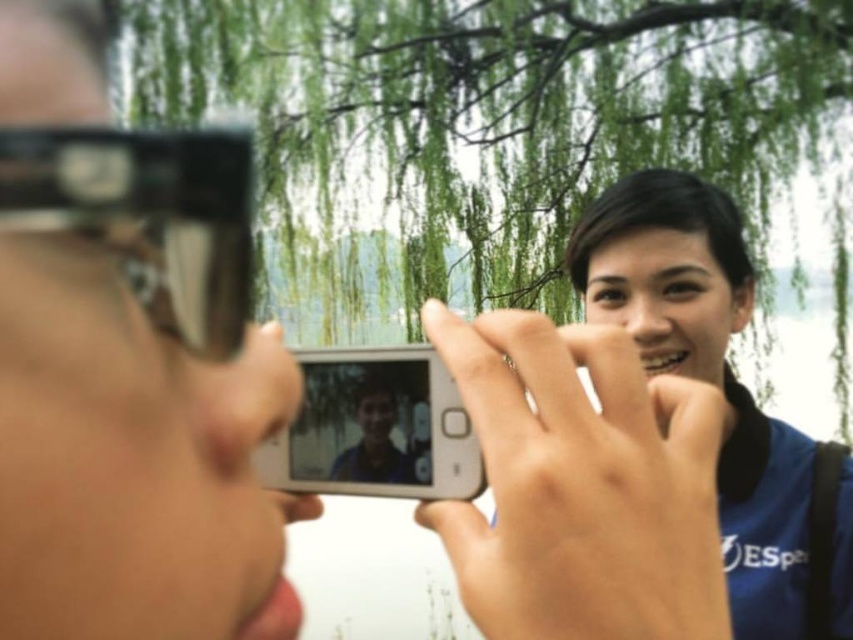
Question: Among these objects, which one is nearest to the camera?

Choices:
 (A) blue fabric shirt at center
 (B) white glossy smartphone at center
 (C) matte black goggles at upper left
 (D) green leafy tree at upper center

Answer: (B)

Question: Which of the following is the farthest from the observer?

Choices:
 (A) green leafy tree at upper center
 (B) white glossy smartphone at center

Answer: (A)

Question: Observing the image, what is the correct spatial positioning of green leafy tree at upper center in reference to matte blue shirt at center?

Choices:
 (A) above
 (B) below

Answer: (A)

Question: Which point is closer to the camera taking this photo?

Choices:
 (A) (405, 433)
 (B) (792, 524)

Answer: (A)

Question: Is green leafy tree at upper center smaller than white glossy smartphone at center?

Choices:
 (A) yes
 (B) no

Answer: (B)

Question: Can you confirm if green leafy tree at upper center is bigger than blue fabric shirt at center?

Choices:
 (A) no
 (B) yes

Answer: (B)